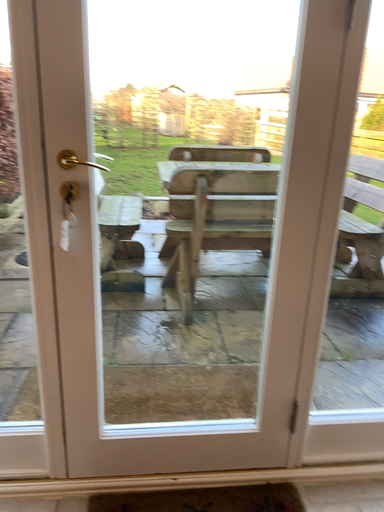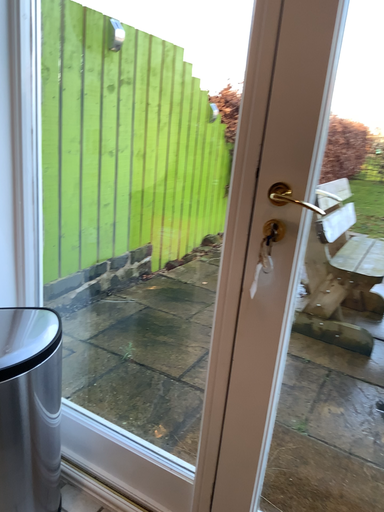
Question: Which way did the camera rotate in the video?

Choices:
 (A) rotated right
 (B) rotated left

Answer: (B)